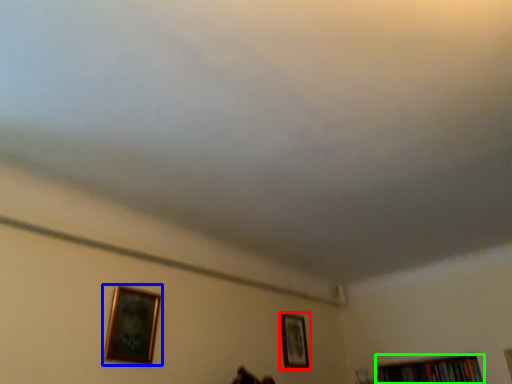
Question: Considering the real-world distances, which object is farthest from picture frame (highlighted by a red box)? picture frame (highlighted by a blue box) or book (highlighted by a green box)?

Choices:
 (A) picture frame
 (B) book

Answer: (A)